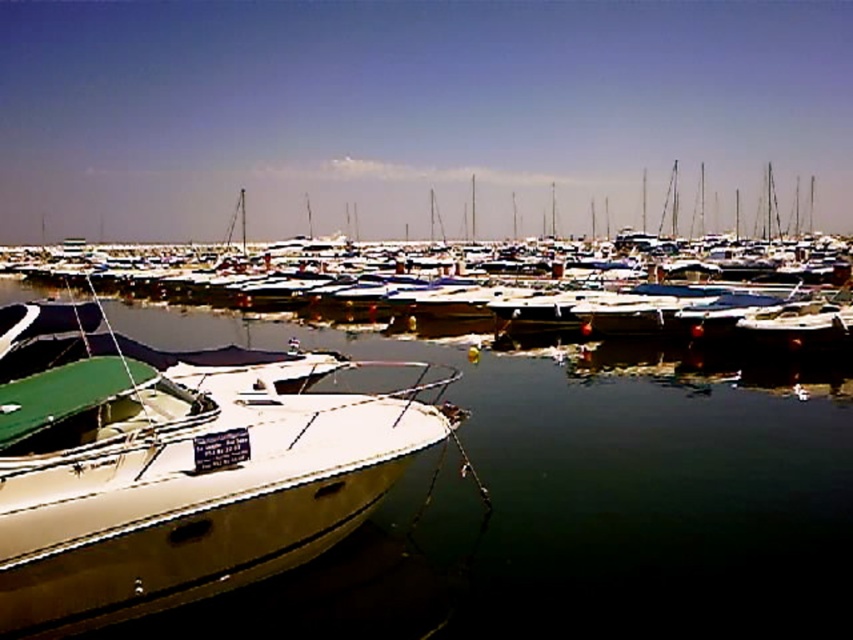
Which is in front, point (495, 451) or point (335, 272)?

Point (495, 451) is in front.

Does point (552, 630) lie in front of point (399, 314)?

That is True.

Does point (201, 324) come behind point (167, 268)?

No, (201, 324) is in front of (167, 268).

Identify the location of clear water at boat front. The image size is (853, 640). (582, 522).